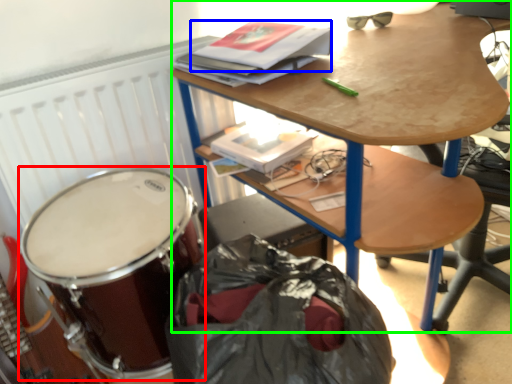
Question: Which object is positioned closest to drum (highlighted by a red box)? Select from paperback book (highlighted by a blue box) and desk (highlighted by a green box).

Choices:
 (A) paperback book
 (B) desk

Answer: (B)